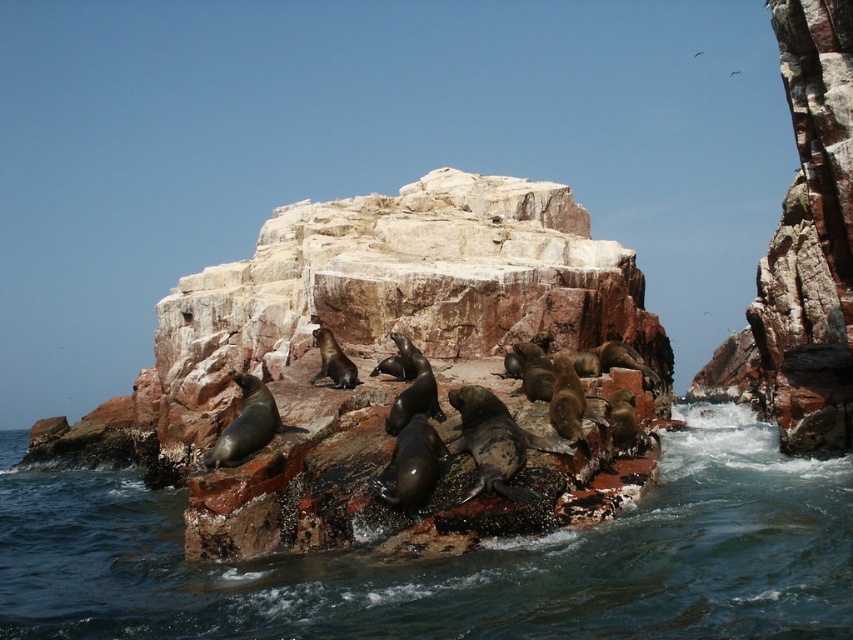
Question: Which object is positioned farthest from the rustic stone rock at center?

Choices:
 (A) smooth rock water at center
 (B) rusty rock at upper right

Answer: (B)

Question: Which point is farther from the camera taking this photo?

Choices:
 (A) (155, 554)
 (B) (531, 204)

Answer: (B)

Question: Is rustic stone rock at center to the left of smooth rock water at center from the viewer's perspective?

Choices:
 (A) yes
 (B) no

Answer: (A)

Question: Estimate the real-world distances between objects in this image. Which object is farther from the rustic stone rock at center?

Choices:
 (A) smooth rock water at center
 (B) rusty rock at upper right

Answer: (B)

Question: Is rustic stone rock at center behind rusty rock at upper right?

Choices:
 (A) no
 (B) yes

Answer: (A)

Question: Is smooth rock water at center bigger than rusty rock at upper right?

Choices:
 (A) yes
 (B) no

Answer: (B)